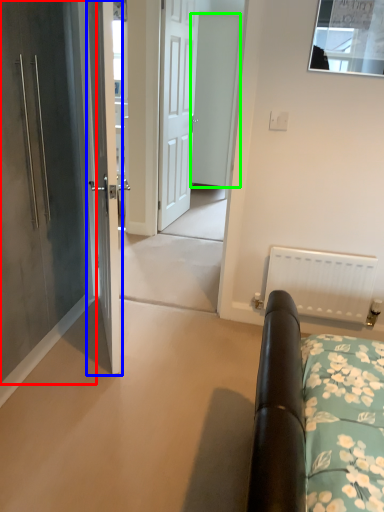
Question: Which is nearer to the door (highlighted by a red box)? door (highlighted by a blue box) or door (highlighted by a green box).

Choices:
 (A) door
 (B) door

Answer: (A)